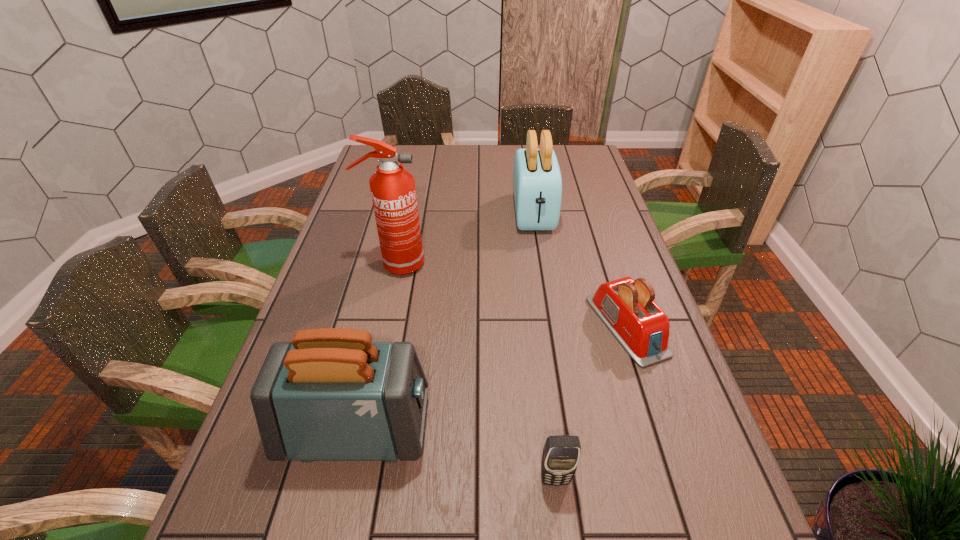
Image resolution: width=960 pixels, height=540 pixels. I want to click on free area in between the farthest toaster and the second farthest object, so click(465, 239).

Identify the location of blank region between the fourth nearest object and the cellular telephone. (475, 372).

Identify the location of free spot between the third nearest object and the second toaster from left to right. (580, 270).

This screenshot has width=960, height=540. In order to click on blank region between the tallest object and the farthest object in this screenshot , I will do `click(465, 239)`.

Where is `free space between the second toaster from right to left and the nearest object`? free space between the second toaster from right to left and the nearest object is located at coordinates (544, 347).

In order to click on free space between the tallest object and the nearest object in this screenshot , I will do `click(475, 372)`.

Locate an element on the screen. Image resolution: width=960 pixels, height=540 pixels. the closest object to the fourth farthest object is located at coordinates (561, 454).

Identify which object is located as the fourth nearest to the shortest toaster. Please provide its 2D coordinates. Your answer should be formatted as a tuple, i.e. [(x, y)], where the tuple contains the x and y coordinates of a point satisfying the conditions above.

[(393, 191)]

Identify which toaster is located as the second nearest to the cellular telephone. Please provide its 2D coordinates. Your answer should be formatted as a tuple, i.e. [(x, y)], where the tuple contains the x and y coordinates of a point satisfying the conditions above.

[(627, 308)]

This screenshot has height=540, width=960. What are the coordinates of `toaster that is the second closest to the second toaster from right to left` in the screenshot? It's located at (331, 394).